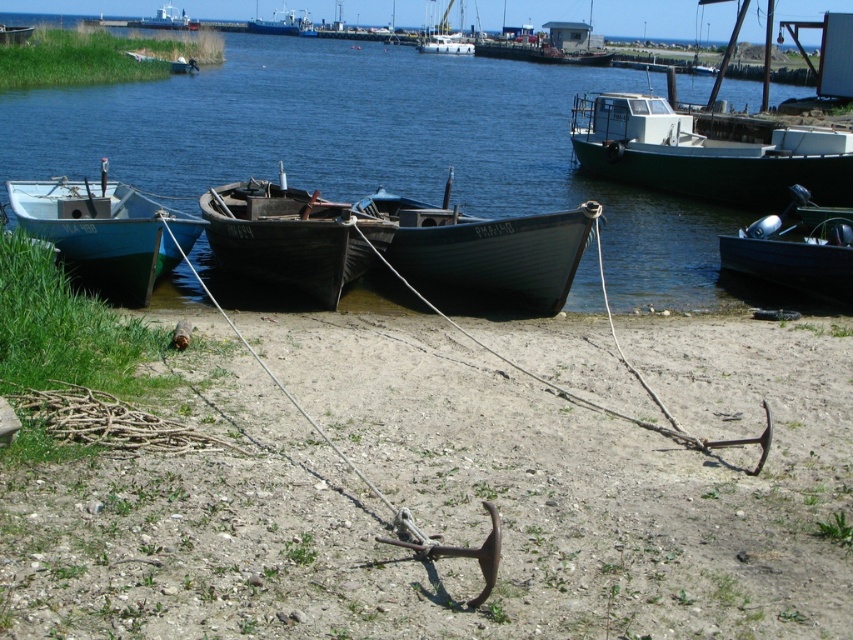
Does green wooden boats at center have a greater height compared to metallic gray dinghy at right?

Correct, green wooden boats at center is much taller as metallic gray dinghy at right.

Between point (746, 86) and point (820, 240), which one is positioned in front?

Point (820, 240) is in front.

You are a GUI agent. You are given a task and a screenshot of the screen. Output one action in this format:
    pyautogui.click(x=<x>, y=<y>)
    Task: Click on the green wooden boats at center
    Image resolution: width=853 pixels, height=640 pixels.
    Given the screenshot: What is the action you would take?
    pyautogui.click(x=373, y=144)

Is brown gravel anchor at lower center below green matte boat at upper right?

Indeed, brown gravel anchor at lower center is positioned under green matte boat at upper right.

Which is in front, point (94, 596) or point (587, 150)?

Point (94, 596)

Locate an element on the screen. The width and height of the screenshot is (853, 640). brown gravel anchor at lower center is located at coordinates (453, 493).

Between metallic gray dinghy at right and white glossy ship at upper center, which one appears on the right side from the viewer's perspective?

metallic gray dinghy at right

Does metallic gray dinghy at right appear on the left side of white glossy ship at upper center?

No, metallic gray dinghy at right is not to the left of white glossy ship at upper center.

Describe the element at coordinates (796, 248) in the screenshot. This screenshot has width=853, height=640. I see `metallic gray dinghy at right` at that location.

Identify the location of metallic gray dinghy at right. The image size is (853, 640). 796,248.